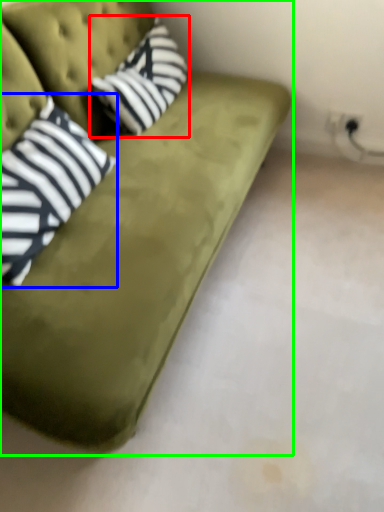
Question: Based on their relative distances, which object is nearer to throw pillow (highlighted by a red box)? Choose from pillow (highlighted by a blue box) and studio couch (highlighted by a green box).

Choices:
 (A) pillow
 (B) studio couch

Answer: (B)